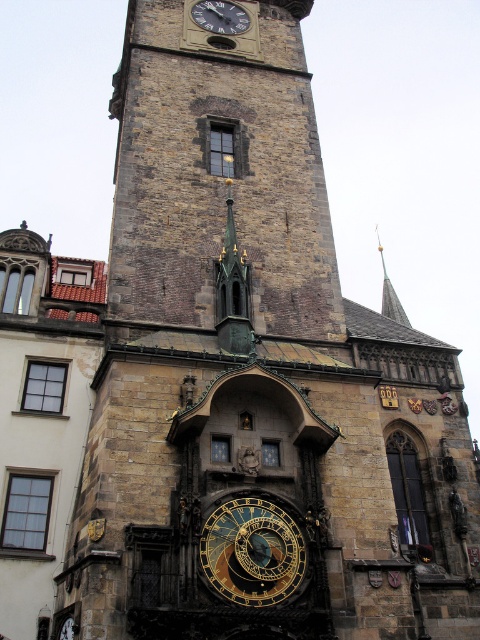
You are standing in front of the historic stone tower and see the point marked at coordinates [252,552]. What object does this point indicate?

The point at coordinates [252,552] corresponds to the gold metallic clock at center.